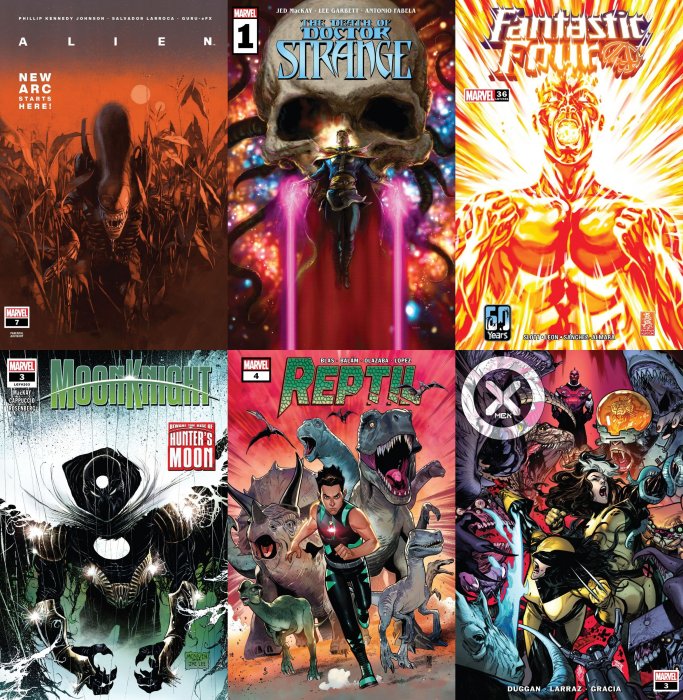
In order to click on floor in this screenshot , I will do `click(288, 682)`.